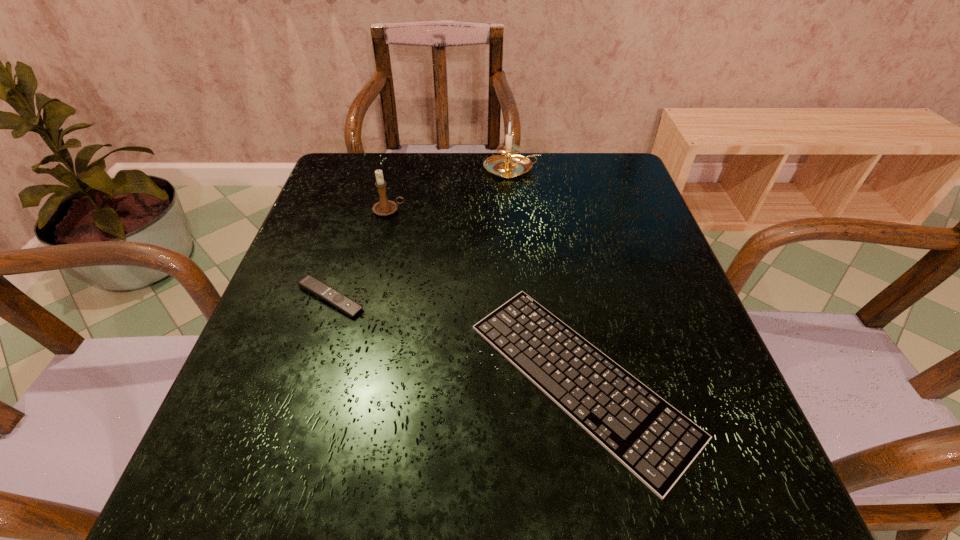
The image size is (960, 540). Identify the location of the farthest object. (509, 166).

Identify the location of the tallest object. This screenshot has width=960, height=540. (509, 166).

Locate an element on the screen. The width and height of the screenshot is (960, 540). the nearer candle holder is located at coordinates (384, 207).

Locate an element on the screen. the shorter candle holder is located at coordinates (384, 207).

Find the location of a particular element. Image resolution: width=960 pixels, height=540 pixels. remote control is located at coordinates (309, 283).

Where is `computer keyboard`? computer keyboard is located at coordinates point(652,439).

What are the coordinates of `vacant area situated 0.180m on the handle side of the farther candle holder` in the screenshot? It's located at (605, 169).

At what (x,y) coordinates should I click in order to perform the action: click on vacant space positioned 0.090m on the side of the second tallest object with the handle. Please return your answer as a coordinate pair (x, y). This screenshot has height=540, width=960. Looking at the image, I should click on (442, 211).

The width and height of the screenshot is (960, 540). I want to click on free space located on the back of the remote control, so click(x=361, y=205).

Where is `vacant space situated on the back of the computer keyboard`? vacant space situated on the back of the computer keyboard is located at coordinates (547, 206).